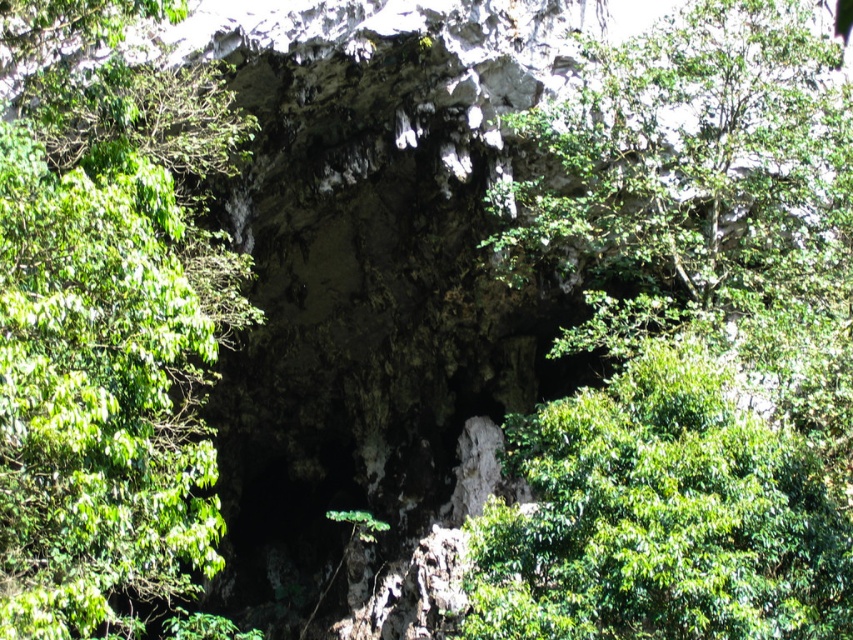
Which is in front, point (788, 580) or point (138, 600)?

Point (788, 580) is in front.

Who is more distant from viewer, (572, 122) or (45, 157)?

The point (572, 122) is more distant.

This screenshot has height=640, width=853. I want to click on green leafy tree at center, so click(x=691, y=348).